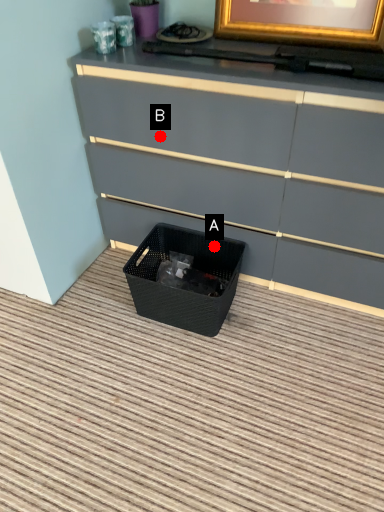
Question: Two points are circled on the image, labeled by A and B beside each circle. Which point is farther from the camera taking this photo?

Choices:
 (A) A is further
 (B) B is further

Answer: (A)